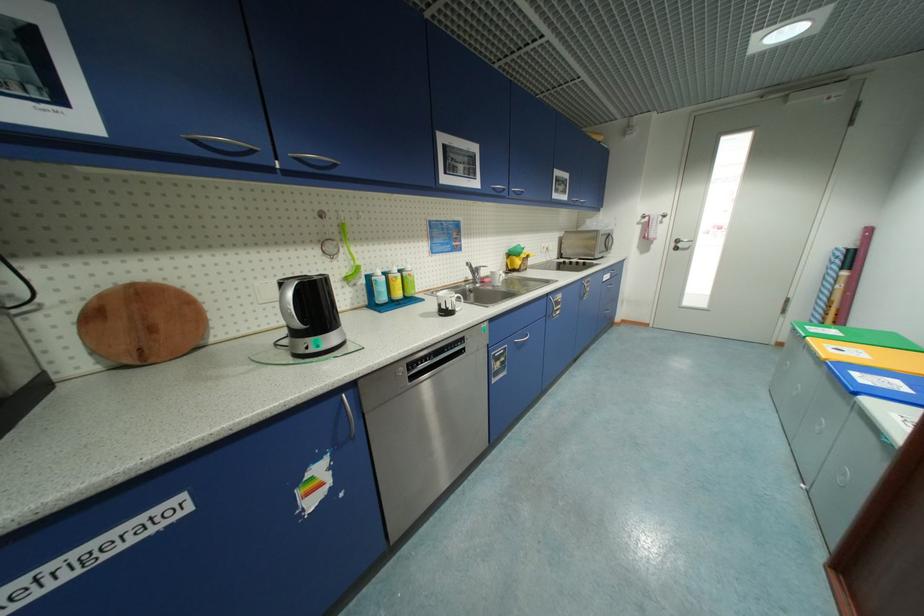
The height and width of the screenshot is (616, 924). What do you see at coordinates (379, 288) in the screenshot?
I see `the blue bottle pump` at bounding box center [379, 288].